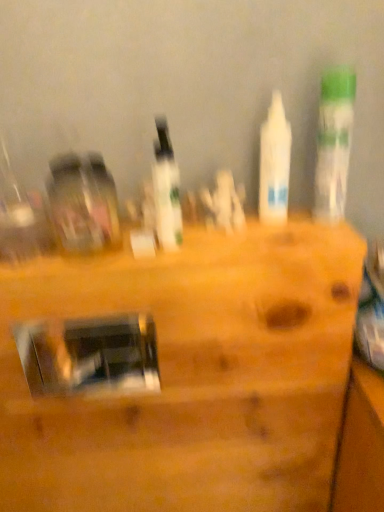
I want to click on free location to the left of white glossy bottle at upper right, the first bottle viewed from the right, so click(x=258, y=231).